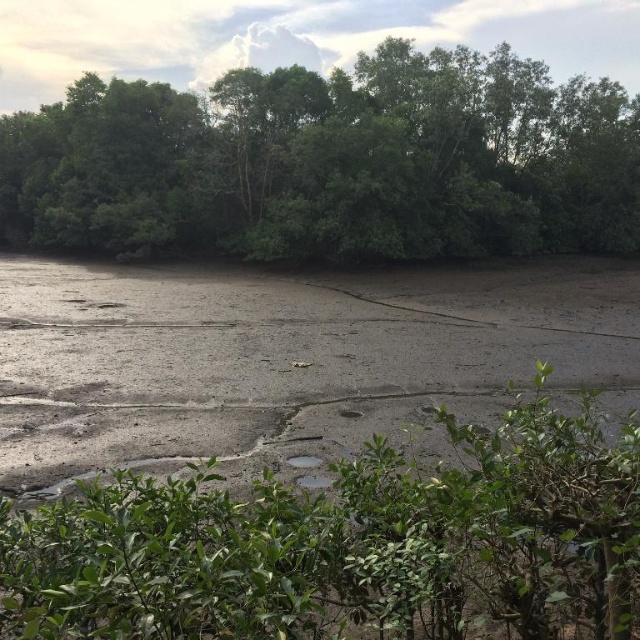
Question: Can you confirm if green leafy trees at upper center is smaller than green leafy bush at center?

Choices:
 (A) no
 (B) yes

Answer: (A)

Question: Considering the relative positions of green leafy trees at upper center and green leafy bush at center in the image provided, where is green leafy trees at upper center located with respect to green leafy bush at center?

Choices:
 (A) above
 (B) below

Answer: (A)

Question: Which object appears closest to the camera in this image?

Choices:
 (A) green leafy bush at center
 (B) green leafy trees at upper center

Answer: (A)

Question: Is green leafy trees at upper center to the left of green leafy bush at center from the viewer's perspective?

Choices:
 (A) yes
 (B) no

Answer: (A)

Question: Which of the following is the farthest from the observer?

Choices:
 (A) [506, 580]
 (B) [378, 234]

Answer: (B)